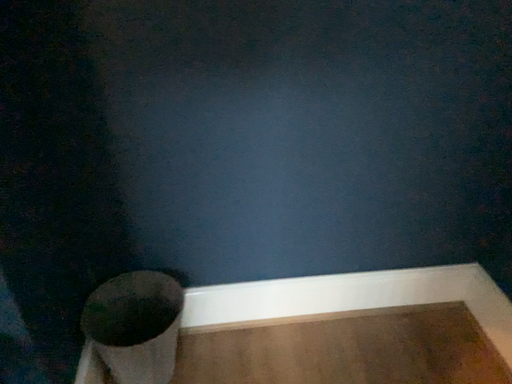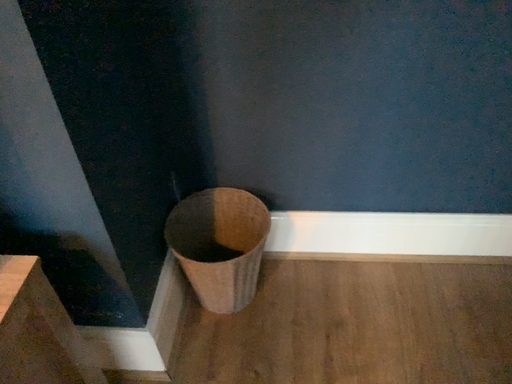
Question: Which way did the camera rotate in the video?

Choices:
 (A) rotated left
 (B) rotated right

Answer: (A)